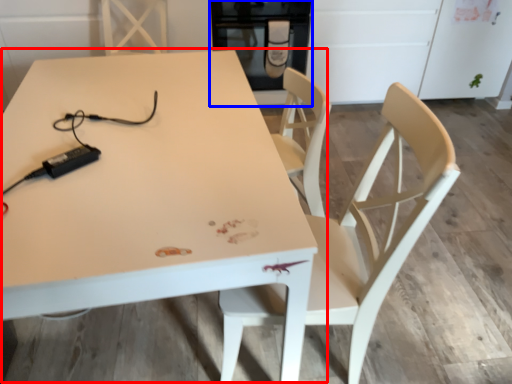
Question: Which object is further to the camera taking this photo, table (highlighted by a red box) or appliance (highlighted by a blue box)?

Choices:
 (A) table
 (B) appliance

Answer: (B)